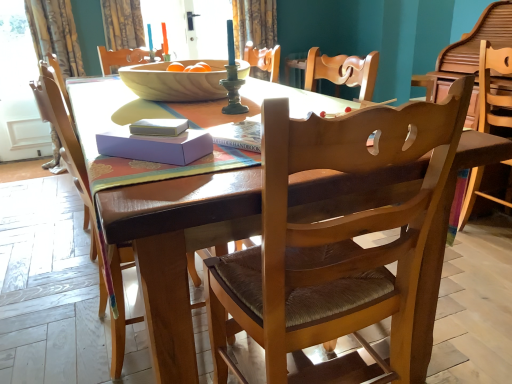
The image size is (512, 384). Identify the location of vacant area that is in front of lavender cardboard box at center. (148, 175).